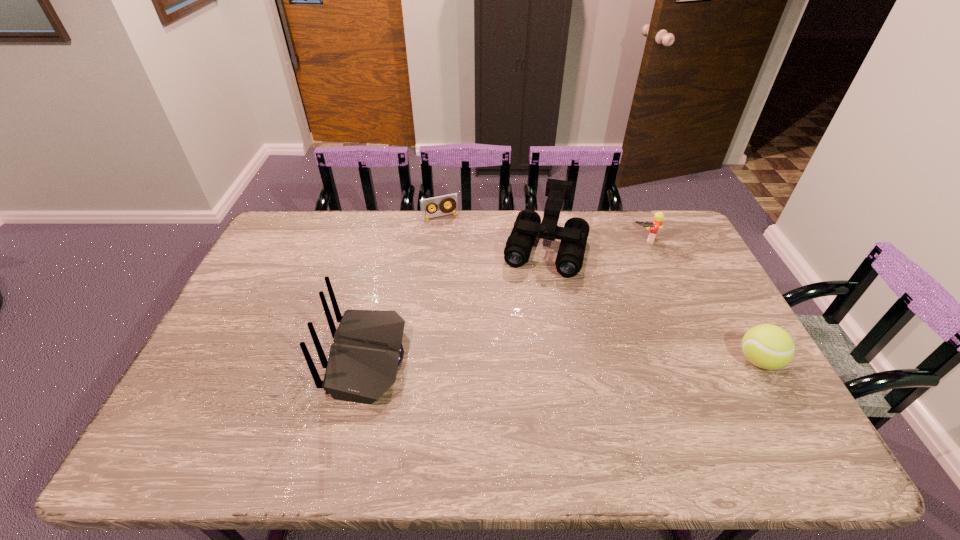
Where is `videotape that is at the far edge`? This screenshot has width=960, height=540. videotape that is at the far edge is located at coordinates (452, 199).

At what (x,y) coordinates should I click in order to perform the action: click on object present at the near edge. Please return your answer as a coordinate pair (x, y). The width and height of the screenshot is (960, 540). Looking at the image, I should click on (367, 349).

At what (x,y) coordinates should I click in order to perform the action: click on tennis ball present at the right edge. Please return your answer as a coordinate pair (x, y). This screenshot has width=960, height=540. Looking at the image, I should click on (767, 346).

Find the location of a particular element. This screenshot has height=540, width=960. Lego that is at the right edge is located at coordinates [x=658, y=217].

Identify the location of object located in the far right corner section of the desktop. coord(658,217).

Find the location of a particular element. This screenshot has width=960, height=540. free space at the far edge of the desktop is located at coordinates (445, 219).

Locate an element on the screen. vacant space at the near edge is located at coordinates (267, 404).

The height and width of the screenshot is (540, 960). I want to click on free spot at the left edge of the desktop, so click(x=256, y=309).

The height and width of the screenshot is (540, 960). I want to click on free region at the right edge, so click(x=718, y=341).

Locate an element on the screen. The height and width of the screenshot is (540, 960). free region at the far left corner of the desktop is located at coordinates (280, 234).